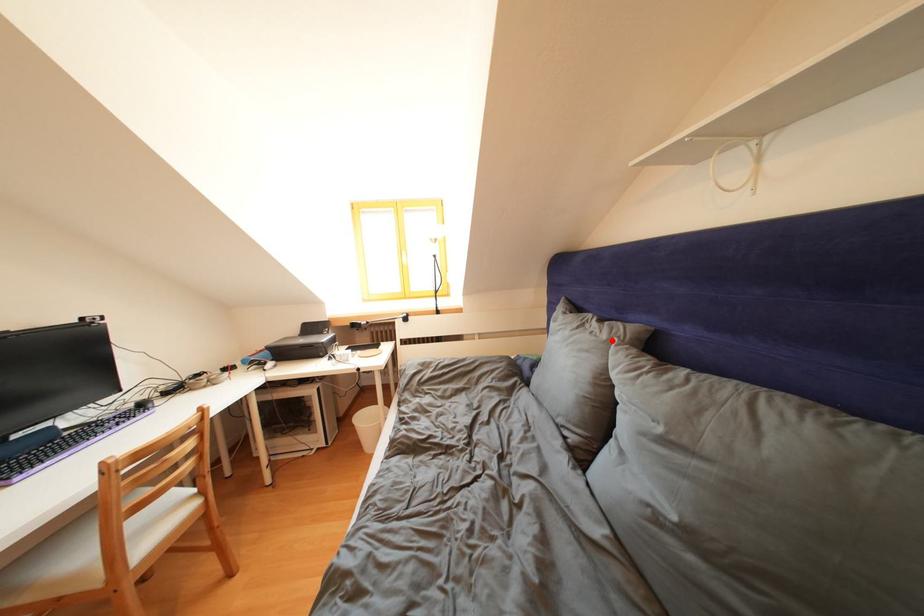
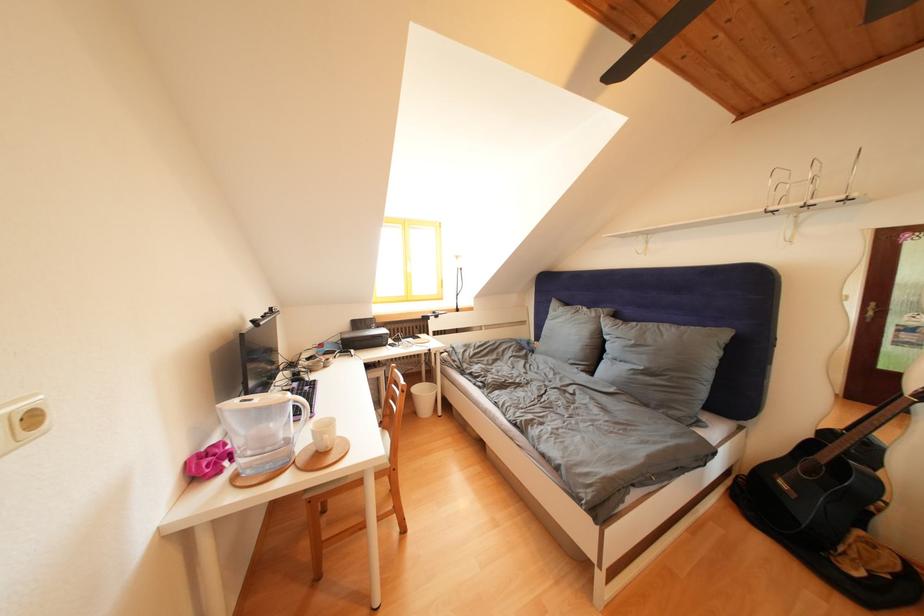
In the second image, find the point that corresponds to the highlighted location in the first image.

(602, 320)